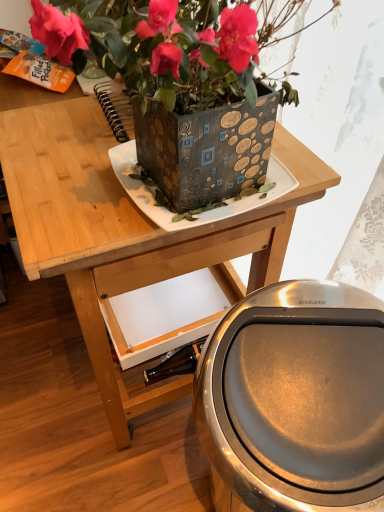
Describe the element at coordinates (124, 224) in the screenshot. This screenshot has height=512, width=384. I see `wooden table at upper center` at that location.

In order to face metallic textured planter at upper center, should I rotate leftwards or rightwards?

Rotate your view right by about 0.572°.

Locate an element on the screen. This screenshot has width=384, height=512. metallic textured planter at upper center is located at coordinates (171, 74).

Find the location of a particular element. This screenshot has height=512, width=384. polished stainless steel trash can at lower right is located at coordinates (295, 400).

From a real-world perspective, which object stands above the other?

In real-world perspective, metallic textured planter at upper center is above.

Identify the location of houseplant on the right of the wooden table at upper center. (171, 74).

Is wooden table at upper center inside or outside of metallic textured planter at upper center?

wooden table at upper center lies outside metallic textured planter at upper center.

Looking at this image, from their relative heights in the image, would you say wooden table at upper center is taller or shorter than metallic textured planter at upper center?

In the image, wooden table at upper center appears to be taller than metallic textured planter at upper center.

Based on the photo, which of these two, wooden table at upper center or polished stainless steel trash can at lower right, is smaller?

polished stainless steel trash can at lower right is smaller.

Is wooden table at upper center directly adjacent to polished stainless steel trash can at lower right?

No, wooden table at upper center is not in contact with polished stainless steel trash can at lower right.

Which is more to the right, wooden table at upper center or polished stainless steel trash can at lower right?

From the viewer's perspective, polished stainless steel trash can at lower right appears more on the right side.

Considering the relative sizes of wooden table at upper center and polished stainless steel trash can at lower right in the image provided, is wooden table at upper center shorter than polished stainless steel trash can at lower right?

No, wooden table at upper center is not shorter than polished stainless steel trash can at lower right.

Which is correct: metallic textured planter at upper center is inside polished stainless steel trash can at lower right, or outside of it?

metallic textured planter at upper center is not inside polished stainless steel trash can at lower right, it's outside.

Does metallic textured planter at upper center have a lesser height compared to polished stainless steel trash can at lower right?

Indeed, metallic textured planter at upper center has a lesser height compared to polished stainless steel trash can at lower right.

How different are the orientations of metallic textured planter at upper center and polished stainless steel trash can at lower right in degrees?

metallic textured planter at upper center and polished stainless steel trash can at lower right are facing 6.5 degrees away from each other.

Is metallic textured planter at upper center oriented away from polished stainless steel trash can at lower right?

No, polished stainless steel trash can at lower right is not at the back of metallic textured planter at upper center.

Which point is more forward, [214,376] or [189,42]?

The point [189,42] is closer.

Considering the sizes of polished stainless steel trash can at lower right and metallic textured planter at upper center in the image, is polished stainless steel trash can at lower right bigger or smaller than metallic textured planter at upper center?

polished stainless steel trash can at lower right is bigger than metallic textured planter at upper center.

Which of these two, polished stainless steel trash can at lower right or metallic textured planter at upper center, is thinner?

polished stainless steel trash can at lower right is thinner.

Does point (346, 309) appear closer or farther from the camera than point (7, 131)?

Point (346, 309).

From a real-world perspective, which object stands above the other?

From a 3D spatial view, wooden table at upper center is above.

Is polished stainless steel trash can at lower right facing towards wooden table at upper center?

No, polished stainless steel trash can at lower right is not aimed at wooden table at upper center.

From the image's perspective, does polished stainless steel trash can at lower right appear higher than wooden table at upper center?

No, from the image's perspective, polished stainless steel trash can at lower right is not above wooden table at upper center.

Locate an element on the screen. The height and width of the screenshot is (512, 384). houseplant to the right of wooden table at upper center is located at coordinates (171, 74).

Consider the image. From the image's perspective, is metallic textured planter at upper center located beneath wooden table at upper center?

No.

Between metallic textured planter at upper center and wooden table at upper center, which one has larger size?

Bigger between the two is wooden table at upper center.

Considering their positions, is metallic textured planter at upper center located in front of or behind wooden table at upper center?

metallic textured planter at upper center is in front of wooden table at upper center.

Where is `table on the left of metallic textured planter at upper center`? The height and width of the screenshot is (512, 384). table on the left of metallic textured planter at upper center is located at coordinates (124, 224).

At what (x,y) coordinates should I click in order to perform the action: click on potty below the wooden table at upper center (from the image's perspective). Please return your answer as a coordinate pair (x, y). The image size is (384, 512). Looking at the image, I should click on coord(295,400).

Based on their spatial positions, is wooden table at upper center or metallic textured planter at upper center closer to polished stainless steel trash can at lower right?

wooden table at upper center lies closer to polished stainless steel trash can at lower right than the other object.

Looking at the image, which one is located closer to metallic textured planter at upper center, polished stainless steel trash can at lower right or wooden table at upper center?

wooden table at upper center is positioned closer to the anchor metallic textured planter at upper center.

Which object lies further to the anchor point wooden table at upper center, polished stainless steel trash can at lower right or metallic textured planter at upper center?

Based on the image, polished stainless steel trash can at lower right appears to be further to wooden table at upper center.

Based on their spatial positions, is metallic textured planter at upper center or polished stainless steel trash can at lower right closer to wooden table at upper center?

metallic textured planter at upper center lies closer to wooden table at upper center than the other object.

Estimate the real-world distances between objects in this image. Which object is closer to metallic textured planter at upper center, wooden table at upper center or polished stainless steel trash can at lower right?

wooden table at upper center lies closer to metallic textured planter at upper center than the other object.

Looking at the image, which one is located closer to polished stainless steel trash can at lower right, metallic textured planter at upper center or wooden table at upper center?

wooden table at upper center is closer to polished stainless steel trash can at lower right.

This screenshot has height=512, width=384. Identify the location of table that lies between metallic textured planter at upper center and polished stainless steel trash can at lower right from top to bottom. (124, 224).